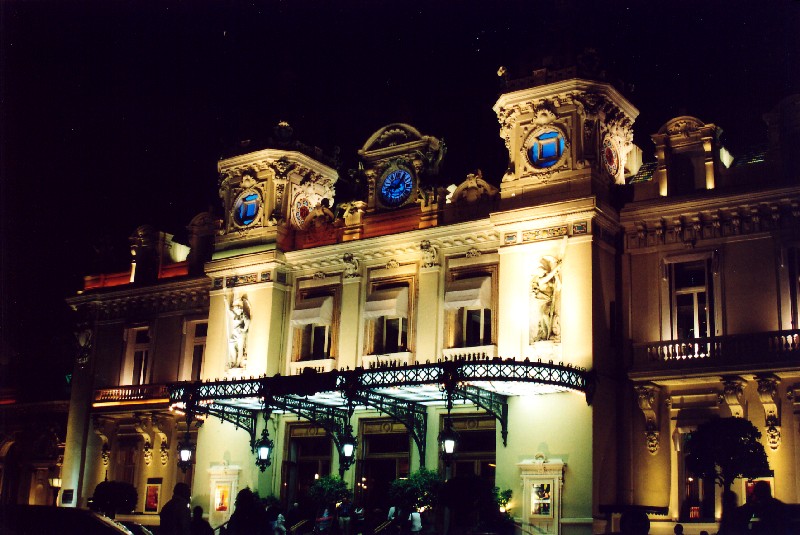
In order to click on hanging lamp in this screenshot , I will do click(182, 456), click(262, 452), click(345, 449), click(449, 444).